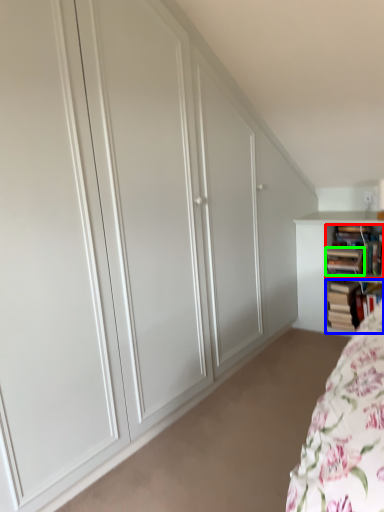
Question: Based on their relative distances, which object is nearer to book (highlighted by a red box)? Choose from book (highlighted by a blue box) and book (highlighted by a green box).

Choices:
 (A) book
 (B) book

Answer: (B)